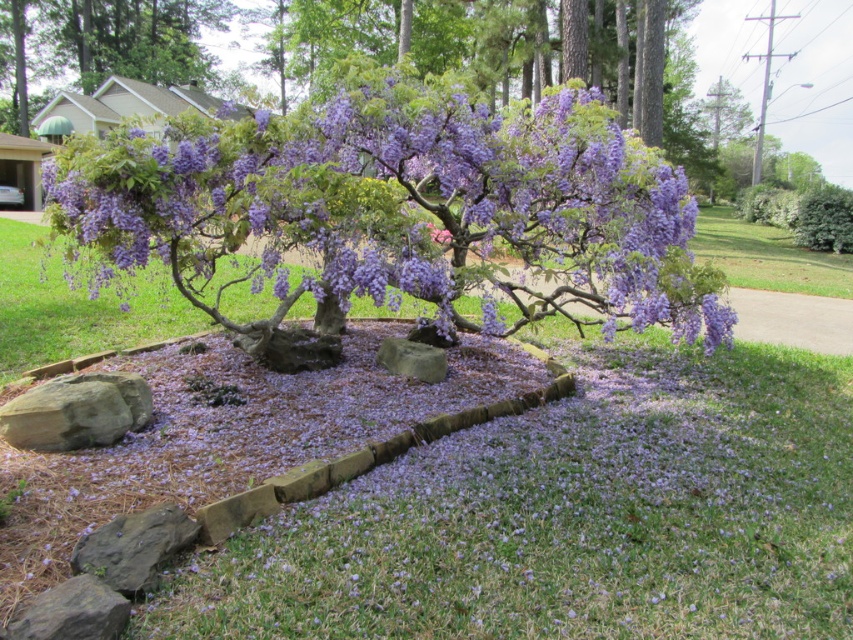
Measure the distance from purple matte flowers at center to gray rock at center.

purple matte flowers at center is 4.53 feet away from gray rock at center.

Is point (482, 152) more distant than point (421, 376)?

No, (482, 152) is closer to viewer.

This screenshot has height=640, width=853. Identify the location of purple matte flowers at center. (403, 208).

Does purple gravel at center lie behind gray rock at center?

No, it is not.

Who is higher up, purple gravel at center or gray rock at center?

gray rock at center

You are a GUI agent. You are given a task and a screenshot of the screen. Output one action in this format:
    pyautogui.click(x=<x>, y=<y>)
    Task: Click on the purple gravel at center
    
    Given the screenshot: What is the action you would take?
    pyautogui.click(x=251, y=442)

Is point (88, 410) closer to camera compared to point (434, 358)?

Yes, point (88, 410) is closer to viewer.

Which of these two, brown rough rock at lower left or gray rock at center, stands shorter?

gray rock at center

Between point (80, 433) and point (433, 356), which one is positioned in front?

Positioned in front is point (80, 433).

Where is `brown rough rock at lower left`? The image size is (853, 640). brown rough rock at lower left is located at coordinates (76, 412).